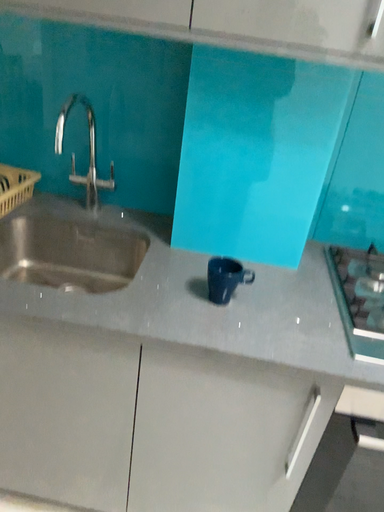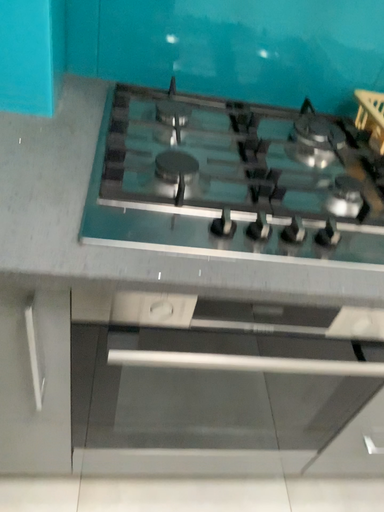
Question: How did the camera likely rotate when shooting the video?

Choices:
 (A) rotated right
 (B) rotated left

Answer: (A)